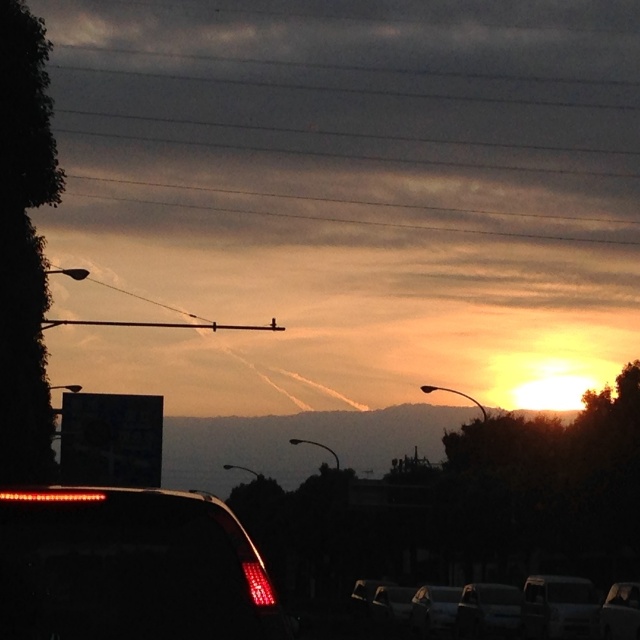
You are standing at the point marked by the coordinate point at point (x=488, y=611). You want to walk towards the metallic silver car at lower center. Which direction should you face to walk directly towards it?

You should face directly towards the metallic silver car at lower center because you are already at the point where it is located.

You are a parking attendant and need to park the shiny black car at lower center and the metallic silver car at center in two adjacent parking spots. The parking spots are exactly the same width. Which car will require a larger parking spot?

The metallic silver car at center requires a larger parking spot because its width is greater than the shiny black car at lower center.

You are a pedestrian standing on the sidewalk and see both the shiny black car at lower center and the metallic silver car at center. Which car appears closer to you?

The shiny black car at lower center appears closer because it is smaller than the metallic silver car at center, indicating it is farther away.